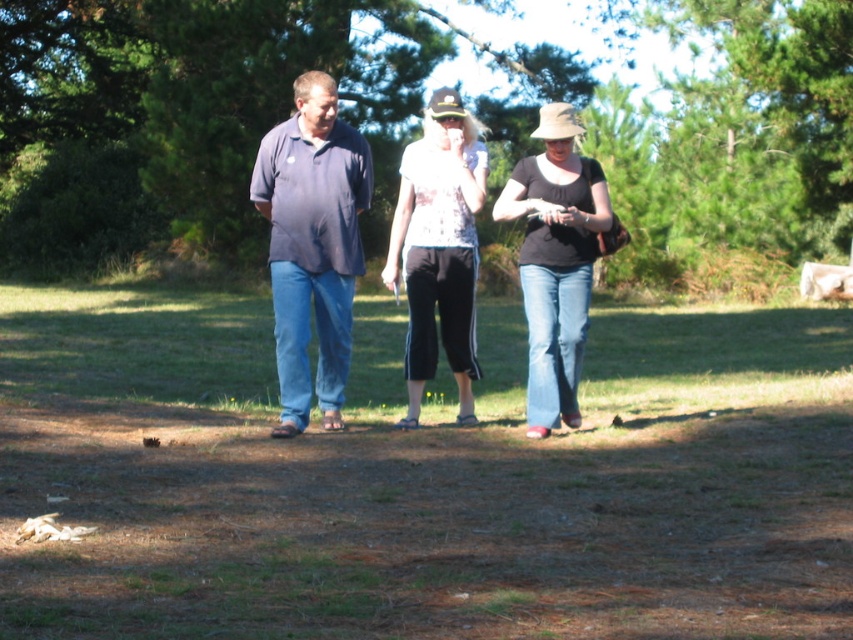
Question: Does blue jeans at center appear over dark blue cotton shirt at center?

Choices:
 (A) no
 (B) yes

Answer: (A)

Question: Can you confirm if blue jeans at center is thinner than black matte shirt at center?

Choices:
 (A) no
 (B) yes

Answer: (A)

Question: Which object is farther from the camera taking this photo?

Choices:
 (A) matte blue shirt at center
 (B) green leafy tree at upper center
 (C) black matte shirt at center
 (D) dark blue cotton shirt at center

Answer: (B)

Question: Which object is closer to the camera taking this photo?

Choices:
 (A) dark blue cotton shirt at center
 (B) matte blue shirt at center

Answer: (A)

Question: Is dark blue cotton shirt at center to the left of white printed blouse at center from the viewer's perspective?

Choices:
 (A) no
 (B) yes

Answer: (B)

Question: Which of the following is the farthest from the observer?

Choices:
 (A) blue jeans at center
 (B) dark blue cotton shirt at center
 (C) white printed blouse at center

Answer: (C)